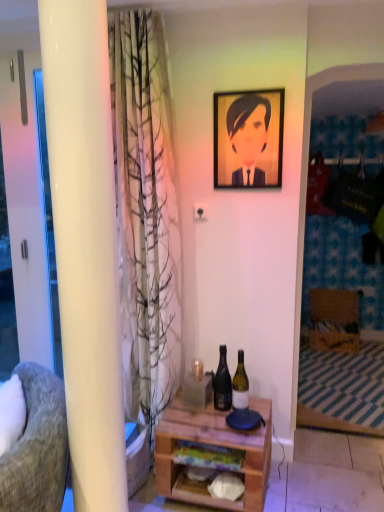
At what (x,y) coordinates should I click in order to perform the action: click on white glossy pillar at left. Please return your answer as a coordinate pair (x, y). The width and height of the screenshot is (384, 512). Looking at the image, I should click on [85, 245].

This screenshot has width=384, height=512. What do you see at coordinates (26, 210) in the screenshot?
I see `white glossy screen door at left` at bounding box center [26, 210].

Identify the location of matte black bottle at center, the 1th bottle positioned from the left. pos(222,383).

The height and width of the screenshot is (512, 384). What are the coordinates of `matte yellow portrait at upper center` in the screenshot? It's located at (249, 136).

Is white glossy pillar at left inside or outside of green glass bottle at center, the first bottle viewed from the right?

white glossy pillar at left is spatially situated outside green glass bottle at center, the first bottle viewed from the right.

Is white glossy pillar at left aimed at green glass bottle at center, the 2th bottle when ordered from left to right?

No.

Considering the relative sizes of white glossy pillar at left and green glass bottle at center, the first bottle viewed from the right, in the image provided, is white glossy pillar at left shorter than green glass bottle at center, the first bottle viewed from the right,?

No.

Is white glossy pillar at left thinner than green glass bottle at center, the 2th bottle when ordered from left to right?

Yes.

Is white glossy pillar at left directly adjacent to matte black bottle at center, the 1th bottle positioned from the left?

No, white glossy pillar at left is not making contact with matte black bottle at center, the 1th bottle positioned from the left.

From the image's perspective, is white glossy pillar at left above or below matte black bottle at center, marked as the second bottle in a right-to-left arrangement?

From the image's perspective, white glossy pillar at left appears above matte black bottle at center, marked as the second bottle in a right-to-left arrangement.

Does point (87, 140) appear closer or farther from the camera than point (216, 394)?

Point (87, 140) appears to be closer to the viewer than point (216, 394).

Who is shorter, white glossy pillar at left or matte black bottle at center, the 1th bottle positioned from the left?

matte black bottle at center, the 1th bottle positioned from the left, is shorter.

Considering the sizes of objects wooden desk at center and white glossy screen door at left in the image provided, who is taller, wooden desk at center or white glossy screen door at left?

With more height is white glossy screen door at left.

Considering the positions of points (185, 492) and (25, 95), is point (185, 492) farther from camera compared to point (25, 95)?

No, it is in front of (25, 95).

Looking at this image, from the image's perspective, is wooden desk at center beneath white glossy screen door at left?

Yes, from the image's perspective, wooden desk at center is below white glossy screen door at left.

Which of these two, wooden desk at center or white glossy screen door at left, is smaller?

Smaller between the two is white glossy screen door at left.

Is white glossy pillar at left with textured gray fabric chair at left?

No.

Is white glossy pillar at left to the right of textured gray fabric chair at left from the viewer's perspective?

In fact, white glossy pillar at left is to the left of textured gray fabric chair at left.

Where is `chair directly beneath the white glossy pillar at left (from a real-world perspective)`? This screenshot has height=512, width=384. chair directly beneath the white glossy pillar at left (from a real-world perspective) is located at coordinates click(37, 446).

From the image's perspective, which one is positioned higher, white glossy pillar at left or textured gray fabric chair at left?

white glossy pillar at left is shown above in the image.

Between matte yellow portrait at upper center and textured gray fabric chair at left, which one is positioned in front?

textured gray fabric chair at left is closer to the camera.

Visually, is matte yellow portrait at upper center positioned to the left or to the right of textured gray fabric chair at left?

In the image, matte yellow portrait at upper center appears on the right side of textured gray fabric chair at left.

How different are the orientations of matte yellow portrait at upper center and textured gray fabric chair at left in degrees?

They differ by 66.7 degrees in their facing directions.

Is matte yellow portrait at upper center taller than textured gray fabric chair at left?

No.

From a real-world perspective, who is located lower, green glass bottle at center, the first bottle viewed from the right, or matte black bottle at center, the 1th bottle positioned from the left?

In real-world perspective, green glass bottle at center, the first bottle viewed from the right, is lower.

Between green glass bottle at center, the 2th bottle when ordered from left to right, and matte black bottle at center, marked as the second bottle in a right-to-left arrangement, which one has smaller size?

green glass bottle at center, the 2th bottle when ordered from left to right, is smaller.

Is green glass bottle at center, the 2th bottle when ordered from left to right, completely or partially outside of matte black bottle at center, marked as the second bottle in a right-to-left arrangement?

Yes, green glass bottle at center, the 2th bottle when ordered from left to right, is located beyond the bounds of matte black bottle at center, marked as the second bottle in a right-to-left arrangement.

Does green glass bottle at center, the first bottle viewed from the right, have a greater width compared to matte black bottle at center, marked as the second bottle in a right-to-left arrangement?

Incorrect, the width of green glass bottle at center, the first bottle viewed from the right, does not surpass that of matte black bottle at center, marked as the second bottle in a right-to-left arrangement.

How far apart are textured gray fabric chair at left and matte yellow portrait at upper center?

textured gray fabric chair at left is 4.49 feet away from matte yellow portrait at upper center.

In the scene shown: From a real-world perspective, is textured gray fabric chair at left located higher than matte yellow portrait at upper center?

No, from a real-world perspective, textured gray fabric chair at left is not above matte yellow portrait at upper center.

From the picture: Is textured gray fabric chair at left placed right next to matte yellow portrait at upper center?

No, textured gray fabric chair at left is not beside matte yellow portrait at upper center.

Considering the relative sizes of textured gray fabric chair at left and matte yellow portrait at upper center in the image provided, is textured gray fabric chair at left bigger than matte yellow portrait at upper center?

Yes, textured gray fabric chair at left is bigger than matte yellow portrait at upper center.

Find the location of a particular element. The width and height of the screenshot is (384, 512). pillar that is above the green glass bottle at center, the 2th bottle when ordered from left to right (from a real-world perspective) is located at coordinates (85, 245).

Identify the location of the 1st bottle below the white glossy pillar at left (from the image's perspective). (222, 383).

From the picture: When comparing their distances from green glass bottle at center, the 2th bottle when ordered from left to right, does matte black bottle at center, the 1th bottle positioned from the left, or wooden desk at center seem closer?

matte black bottle at center, the 1th bottle positioned from the left, is closer to green glass bottle at center, the 2th bottle when ordered from left to right.

When comparing their distances from green glass bottle at center, the 2th bottle when ordered from left to right, does white glossy pillar at left or matte yellow portrait at upper center seem further?

white glossy pillar at left lies further to green glass bottle at center, the 2th bottle when ordered from left to right, than the other object.

Considering their positions, is textured gray fabric chair at left positioned closer to matte yellow portrait at upper center than wooden desk at center?

The object closer to matte yellow portrait at upper center is wooden desk at center.

Based on their spatial positions, is wooden desk at center or green glass bottle at center, the 2th bottle when ordered from left to right, further from white glossy screen door at left?

green glass bottle at center, the 2th bottle when ordered from left to right, is further to white glossy screen door at left.

Estimate the real-world distances between objects in this image. Which object is closer to matte black bottle at center, the 1th bottle positioned from the left, white glossy screen door at left or green glass bottle at center, the 2th bottle when ordered from left to right?

green glass bottle at center, the 2th bottle when ordered from left to right, is closer to matte black bottle at center, the 1th bottle positioned from the left.

When comparing their distances from matte black bottle at center, marked as the second bottle in a right-to-left arrangement, does green glass bottle at center, the 2th bottle when ordered from left to right, or textured gray fabric chair at left seem further?

textured gray fabric chair at left lies further to matte black bottle at center, marked as the second bottle in a right-to-left arrangement, than the other object.

From the image, which object appears to be farther from matte yellow portrait at upper center, white glossy pillar at left or green glass bottle at center, the first bottle viewed from the right?

white glossy pillar at left is further to matte yellow portrait at upper center.

Which object lies further to the anchor point green glass bottle at center, the 2th bottle when ordered from left to right, textured gray fabric chair at left or matte black bottle at center, marked as the second bottle in a right-to-left arrangement?

The object further to green glass bottle at center, the 2th bottle when ordered from left to right, is textured gray fabric chair at left.

Locate an element on the screen. This screenshot has height=512, width=384. pillar between matte yellow portrait at upper center and matte black bottle at center, the 1th bottle positioned from the left, in the up-down direction is located at coordinates (85, 245).

This screenshot has height=512, width=384. What are the coordinates of `chair between matte yellow portrait at upper center and wooden desk at center in the vertical direction` in the screenshot? It's located at (37, 446).

Locate an element on the screen. This screenshot has height=512, width=384. bottle that lies between matte yellow portrait at upper center and green glass bottle at center, the 2th bottle when ordered from left to right, from top to bottom is located at coordinates (222, 383).

Locate an element on the screen. desk between white glossy screen door at left and matte black bottle at center, marked as the second bottle in a right-to-left arrangement is located at coordinates (212, 453).